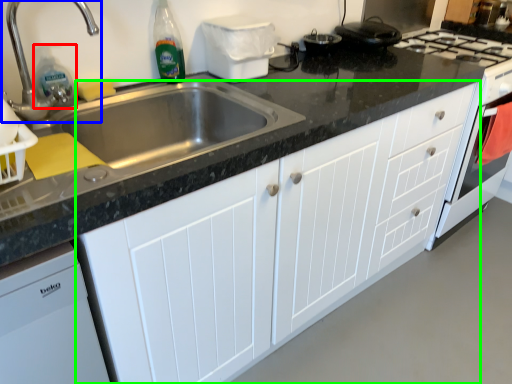
Question: Estimate the real-world distances between objects in this image. Which object is farther from cleaning product (highlighted by a red box), tap (highlighted by a blue box) or cabinetry (highlighted by a green box)?

Choices:
 (A) tap
 (B) cabinetry

Answer: (B)